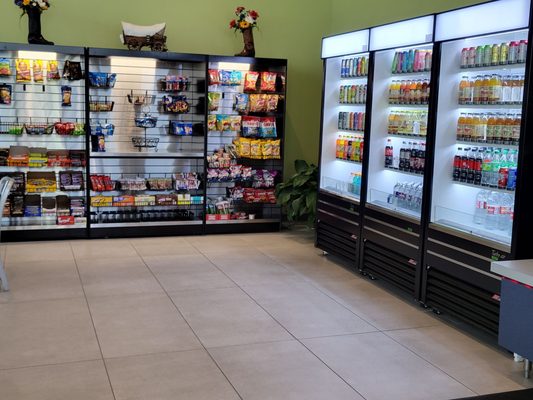
In order to click on fake plant in this screenshot , I will do `click(309, 178)`.